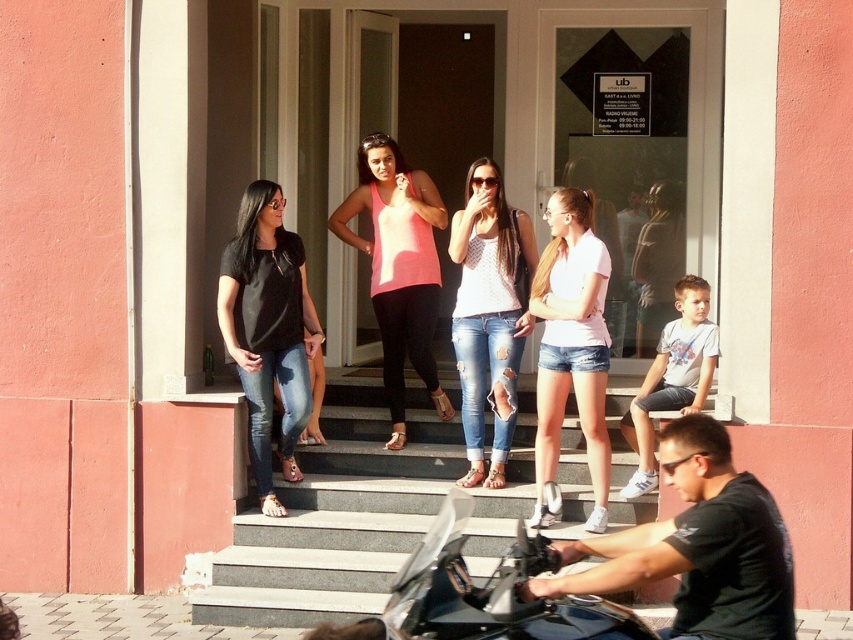
The image size is (853, 640). What do you see at coordinates (335, 518) in the screenshot?
I see `gray concrete stairs at center` at bounding box center [335, 518].

Between point (273, 602) and point (515, 273), which one is positioned in front?

Point (273, 602) is in front.

What do you see at coordinates (335, 518) in the screenshot? Image resolution: width=853 pixels, height=640 pixels. I see `gray concrete stairs at center` at bounding box center [335, 518].

You are a GUI agent. You are given a task and a screenshot of the screen. Output one action in this format:
    pyautogui.click(x=<x>, y=<y>)
    Task: Click on the gray concrete stairs at center
    The height and width of the screenshot is (640, 853).
    Given the screenshot: What is the action you would take?
    pyautogui.click(x=335, y=518)

Who is more distant from viewer, (550, 449) or (410, 317)?

Positioned behind is point (410, 317).

You are a GUI agent. You are given a task and a screenshot of the screen. Output one action in this format:
    pyautogui.click(x=<x>, y=<y>)
    Task: Click on the white denim shorts at center
    The height and width of the screenshot is (640, 853).
    Given the screenshot: What is the action you would take?
    pyautogui.click(x=572, y=348)

I want to click on white denim shorts at center, so click(x=572, y=348).

Who is shorter, shiny black motorcycle at center or white denim shorts at center?

shiny black motorcycle at center

Is point (515, 520) less distant than point (604, 433)?

No.

Between point (405, 618) and point (544, 301), which one is positioned behind?

Positioned behind is point (544, 301).

Identify the location of shiny black motorcycle at center. (483, 595).